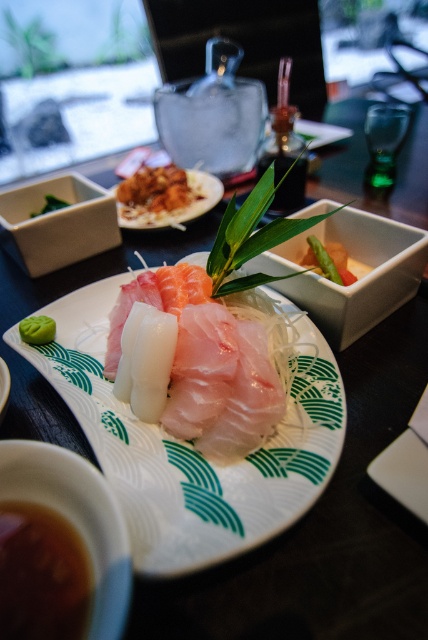
Question: Can you confirm if brown translucent bowl at lower left is positioned to the right of brown rice at upper left?

Choices:
 (A) yes
 (B) no

Answer: (A)

Question: Where is white matte bowl at center-left located in relation to smooth green asparagus at center in the image?

Choices:
 (A) above
 (B) below

Answer: (A)

Question: Which object appears closest to the camera in this image?

Choices:
 (A) brown rice at upper left
 (B) green matte wasabi at center

Answer: (B)

Question: Among these objects, which one is nearest to the camera?

Choices:
 (A) smooth green asparagus at center
 (B) pink translucent sashimi at center

Answer: (B)

Question: Among these points, which one is nearest to the camera?

Choices:
 (A) (154, 168)
 (B) (64, 620)
 (C) (339, 323)

Answer: (B)

Question: Does brown translucent bowl at lower left appear on the left side of white ceramic bowl at center?

Choices:
 (A) no
 (B) yes

Answer: (B)